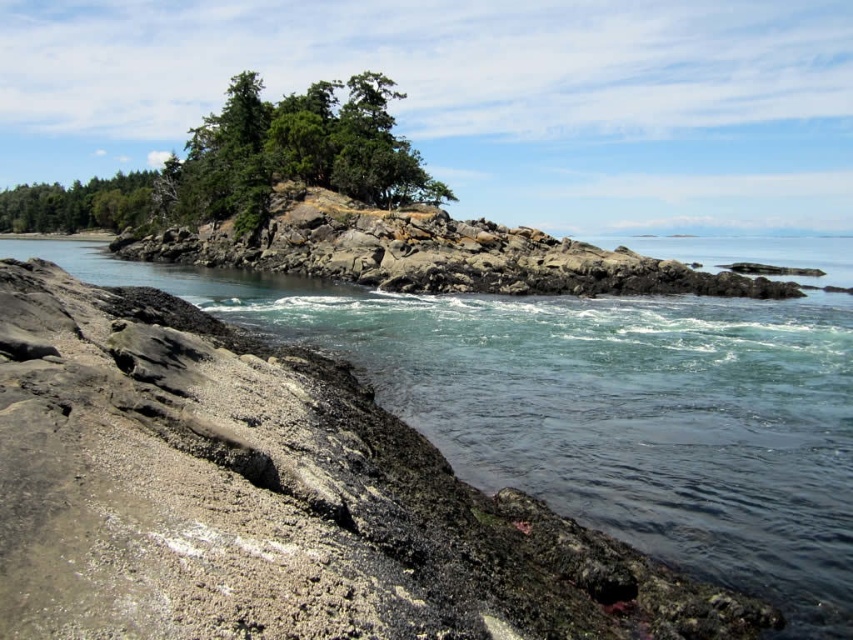
You are standing on the coast looking out at the scene. Which object, the clear water at center or the green textured rock at upper center, is closer to you?

The clear water at center is closer to you because it is in front of the green textured rock at upper center.

You are standing at the edge of the coastal landscape looking out towards the rocky island. You notice two points marked in the scene. Which point, point [688,541] or point [200,243], is closer to you?

Point [688,541] is closer to the camera than point [200,243], so it is closer to you.

You are standing at the point marked as point [706,358] in the coastal landscape. A seagull is flying towards you from the direction of the rocky island. If the seagull flies at a constant speed of 10 meters per second, how many seconds will it take for the seagull to reach you?

The seagull is flying towards you from the rocky island, which is 26.83 meters away. At a speed of 10 meters per second, it will take approximately 2.68 seconds for the seagull to reach you.